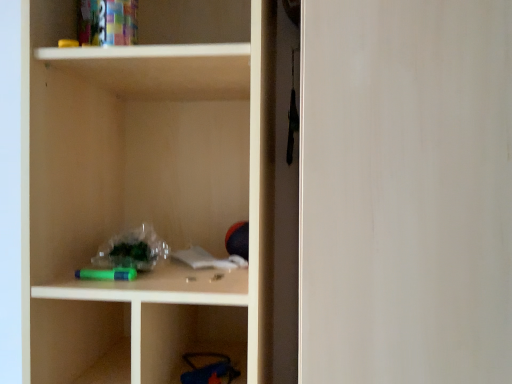
Question: Should I look upward or downward to see matte wood cabinet at center?

Choices:
 (A) down
 (B) up

Answer: (A)

Question: Is the depth of matte wood cabinet at center greater than that of transparent glass door at right?

Choices:
 (A) yes
 (B) no

Answer: (A)

Question: Does matte wood cabinet at center have a lesser height compared to transparent glass door at right?

Choices:
 (A) yes
 (B) no

Answer: (B)

Question: Is transparent glass door at right located within matte wood cabinet at center?

Choices:
 (A) no
 (B) yes

Answer: (A)

Question: Is matte wood cabinet at center touching transparent glass door at right?

Choices:
 (A) yes
 (B) no

Answer: (B)

Question: From a real-world perspective, is matte wood cabinet at center positioned under transparent glass door at right based on gravity?

Choices:
 (A) yes
 (B) no

Answer: (B)

Question: Could you tell me if matte wood cabinet at center is facing transparent glass door at right?

Choices:
 (A) no
 (B) yes

Answer: (A)

Question: From a real-world perspective, is transparent glass door at right physically above matte wood cabinet at center?

Choices:
 (A) yes
 (B) no

Answer: (B)

Question: Does transparent glass door at right appear on the right side of matte wood cabinet at center?

Choices:
 (A) no
 (B) yes

Answer: (B)

Question: From the image's perspective, is transparent glass door at right on matte wood cabinet at center?

Choices:
 (A) no
 (B) yes

Answer: (A)

Question: From a real-world perspective, is transparent glass door at right under matte wood cabinet at center?

Choices:
 (A) yes
 (B) no

Answer: (A)

Question: Is transparent glass door at right further to camera compared to matte wood cabinet at center?

Choices:
 (A) no
 (B) yes

Answer: (A)

Question: Is transparent glass door at right turned away from matte wood cabinet at center?

Choices:
 (A) no
 (B) yes

Answer: (A)

Question: Is matte wood cabinet at center bigger or smaller than transparent glass door at right?

Choices:
 (A) small
 (B) big

Answer: (A)